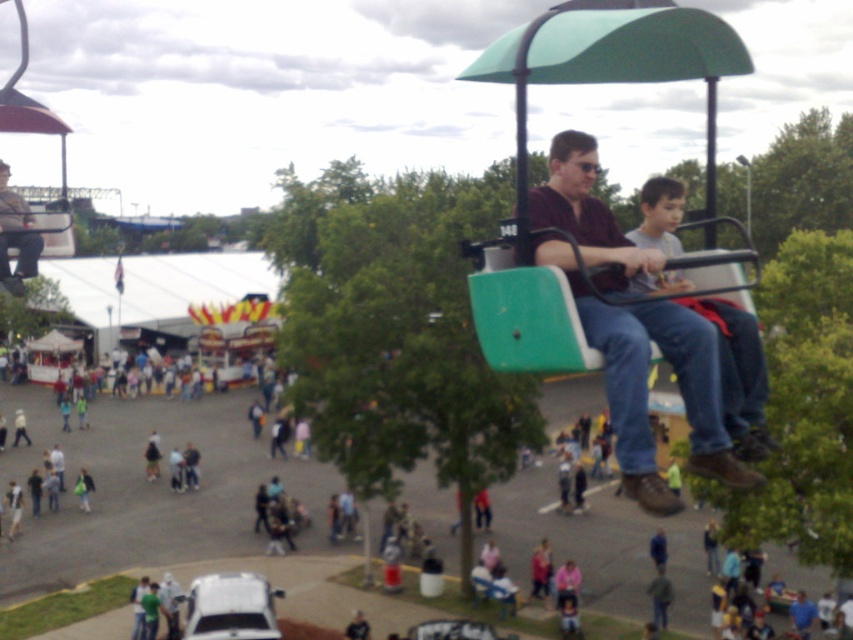
Is matte brown shirt at center thinner than matte black jacket at upper center?

No, matte brown shirt at center is not thinner than matte black jacket at upper center.

Who is positioned more to the right, matte brown shirt at center or matte black jacket at upper center?

Positioned to the right is matte brown shirt at center.

Is point (659, 497) less distant than point (42, 243)?

Yes, it is.

The image size is (853, 640). I want to click on matte brown shirt at center, so click(x=645, y=381).